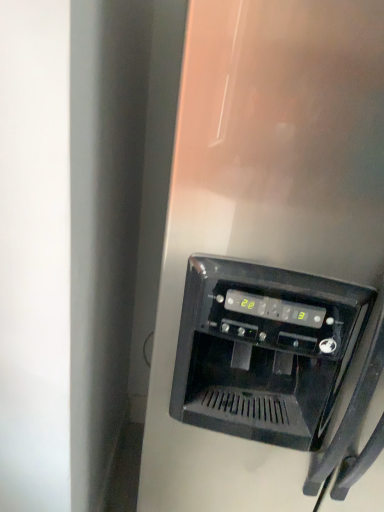
Measure the distance between point (310, 189) and camera.

A distance of 25.79 inches exists between point (310, 189) and camera.

What do you see at coordinates (272, 265) in the screenshot? Image resolution: width=384 pixels, height=512 pixels. I see `stainless steel refrigerator at center` at bounding box center [272, 265].

Find the location of a particular element. Image resolution: width=384 pixels, height=512 pixels. stainless steel refrigerator at center is located at coordinates (272, 265).

Find the location of a particular element. The height and width of the screenshot is (512, 384). stainless steel refrigerator at center is located at coordinates (272, 265).